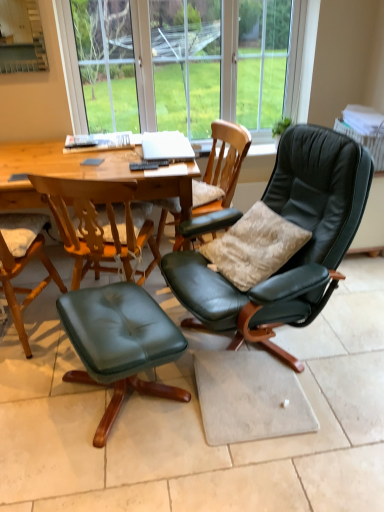
Where is `free spot below green leather ottoman at lower left (from a real-world perspective)`? Image resolution: width=384 pixels, height=512 pixels. free spot below green leather ottoman at lower left (from a real-world perspective) is located at coordinates (124, 406).